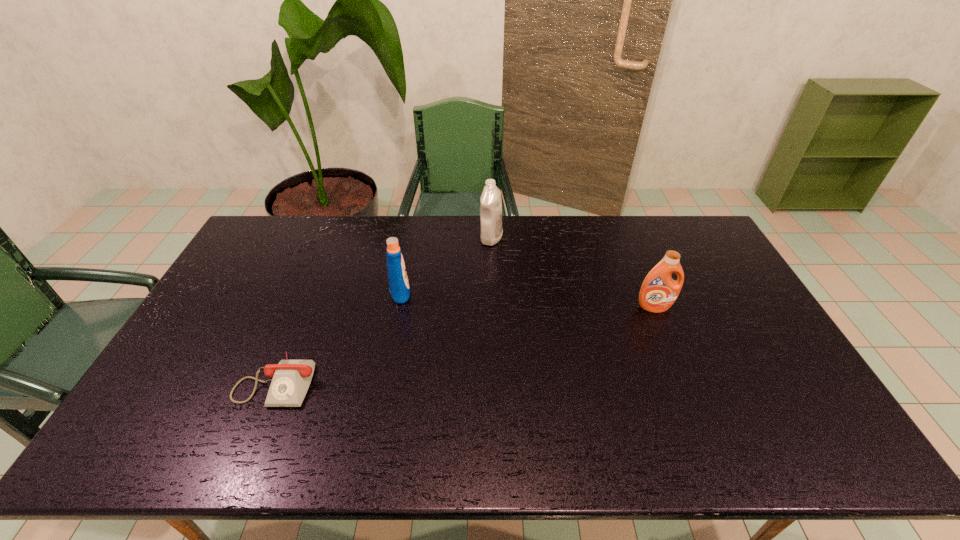
The image size is (960, 540). I want to click on object situated at the far edge, so click(x=491, y=230).

Where is `vacant region at the far edge of the desktop`? The height and width of the screenshot is (540, 960). vacant region at the far edge of the desktop is located at coordinates (513, 242).

Where is `vacant space at the near edge`? The height and width of the screenshot is (540, 960). vacant space at the near edge is located at coordinates (703, 428).

The width and height of the screenshot is (960, 540). I want to click on vacant space at the left edge of the desktop, so click(x=228, y=324).

What are the coordinates of `vacant space at the near left corner` in the screenshot? It's located at (168, 451).

At what (x,y) coordinates should I click in order to perform the action: click on blank region between the third object from right to left and the farthest detergent. Please return your answer as a coordinate pair (x, y). The width and height of the screenshot is (960, 540). Looking at the image, I should click on (445, 265).

What are the coordinates of `free space between the second object from left to right and the shortest object` in the screenshot? It's located at (339, 335).

Identify the location of free point between the third object from right to left and the telephone. This screenshot has height=540, width=960. (339, 335).

You are a GUI agent. You are given a task and a screenshot of the screen. Output one action in this format:
    pyautogui.click(x=<x>, y=<y>)
    Task: Click on the free area in between the second object from right to left and the shortest object
    The height and width of the screenshot is (540, 960).
    Given the screenshot: What is the action you would take?
    pyautogui.click(x=384, y=309)

This screenshot has width=960, height=540. What are the coordinates of `free spot between the rightmost object and the farthest detergent` in the screenshot? It's located at (573, 273).